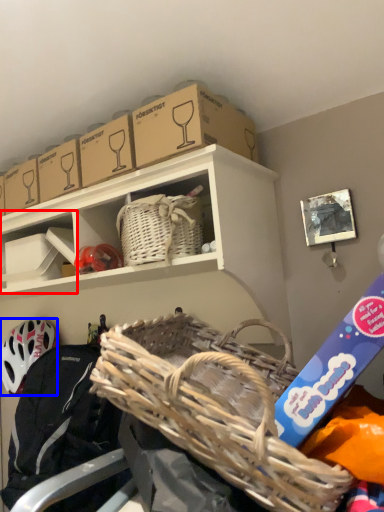
Question: Which of the following is the farthest to the observer, shelf (highlighted by a red box) or helmet (highlighted by a blue box)?

Choices:
 (A) shelf
 (B) helmet

Answer: (B)